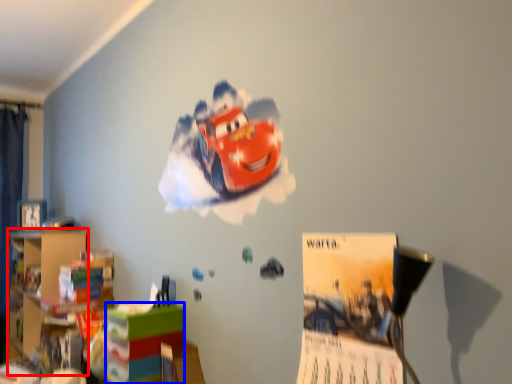
Question: Among these objects, which one is farthest to the camera, bookshelf (highlighted by a red box) or shelf (highlighted by a blue box)?

Choices:
 (A) bookshelf
 (B) shelf

Answer: (A)